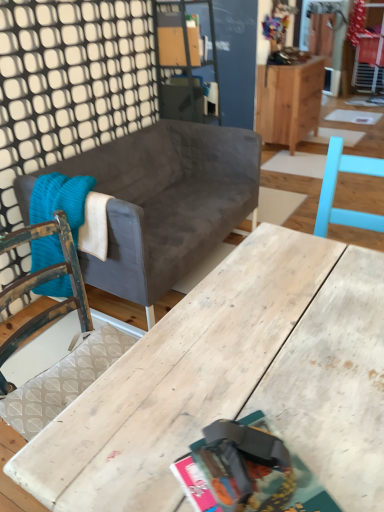
The height and width of the screenshot is (512, 384). Find the location of `vacant area situated to the left side of matte paper magazine at center`. vacant area situated to the left side of matte paper magazine at center is located at coordinates (132, 460).